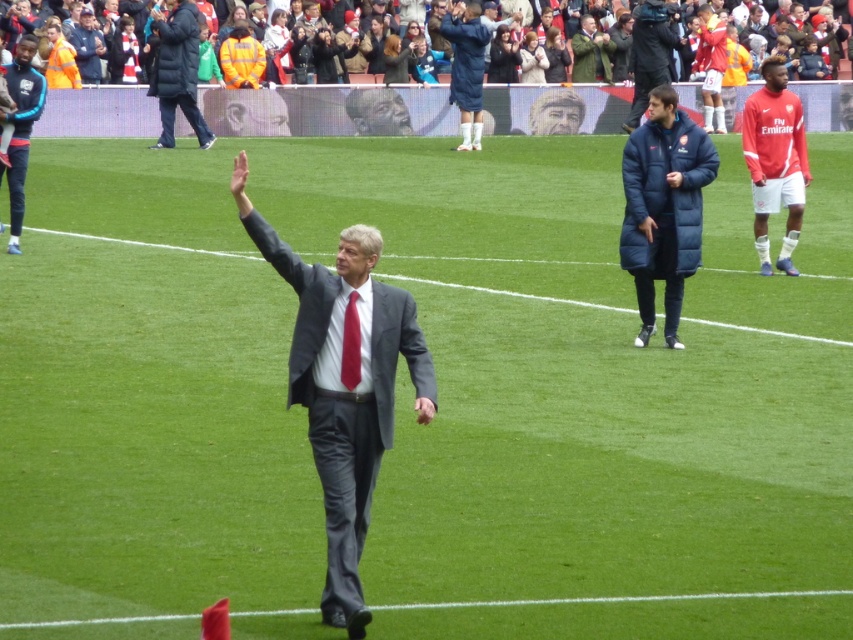
You are a photographer at the stadium and need to capture a photo of both the dark blue wool coat at center and the dark blue padded jacket at upper left. Which object should you focus on first to ensure both are in the frame?

The dark blue padded jacket at upper left should be focused on first because the dark blue wool coat at center is positioned to its right, so adjusting the frame to include the jacket first ensures both are captured.

In the scene shown: You are a photographer positioned at the bottom of the stadium, aiming to capture a photo of the blue down jacket at upper center. Based on its coordinates, is it positioned to the left or right side of the image?

The blue down jacket at upper center is located at point 0.109 on the x axis, which is closer to the left side of the image since lower x values indicate positions further left.